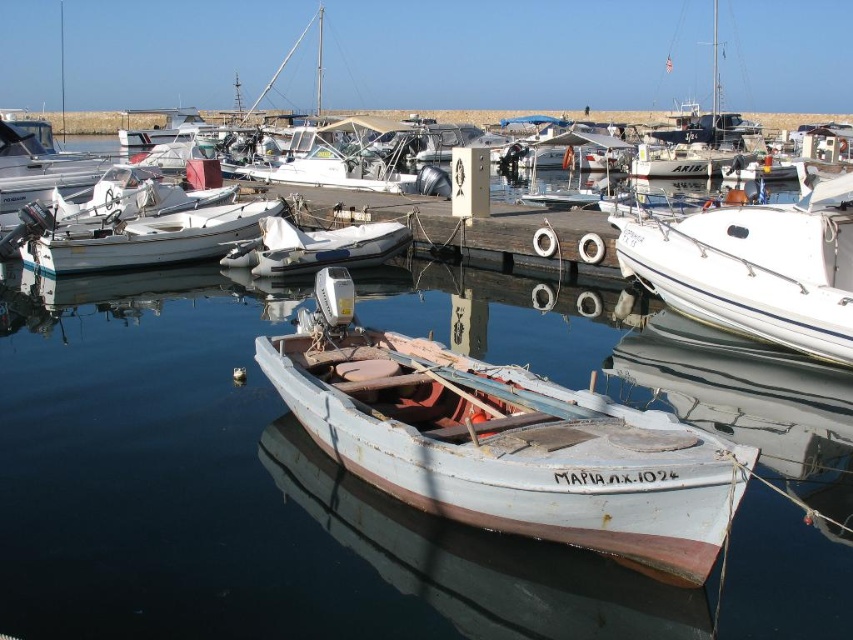
You are a dock worker who needs to move the white glossy boat at right to a new location. The space available is only 3 meters wide. Can the white weathered boat at center fit into this space if it were moved instead?

The white weathered boat at center is wider than the white glossy boat at right. Since the available space is 3 meters wide, if the white glossy boat at right can fit, the white weathered boat at center may not due to its larger width.

You are a photographer planning to take a photo of the white glossy boat at right and the white rubber dinghy at center from the pier. Which boat will appear taller in the photo?

The white glossy boat at right will appear taller in the photo because it has a greater height compared to the white rubber dinghy at center.

You are standing on the wooden pier and see the white weathered boat at center and the white glossy boat at right. Which boat is closer to the left side of the pier?

The white weathered boat at center is closer to the left side of the pier than the white glossy boat at right.